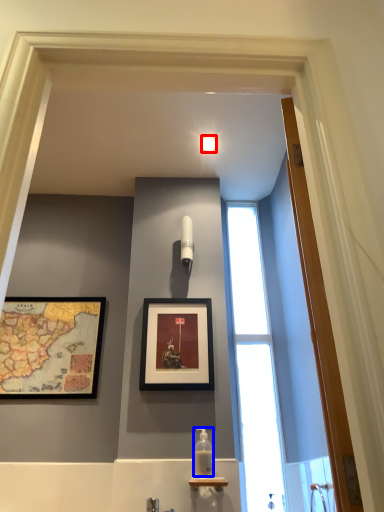
Question: Which object is closer to the camera taking this photo, light fixture (highlighted by a red box) or bottle (highlighted by a blue box)?

Choices:
 (A) light fixture
 (B) bottle

Answer: (B)